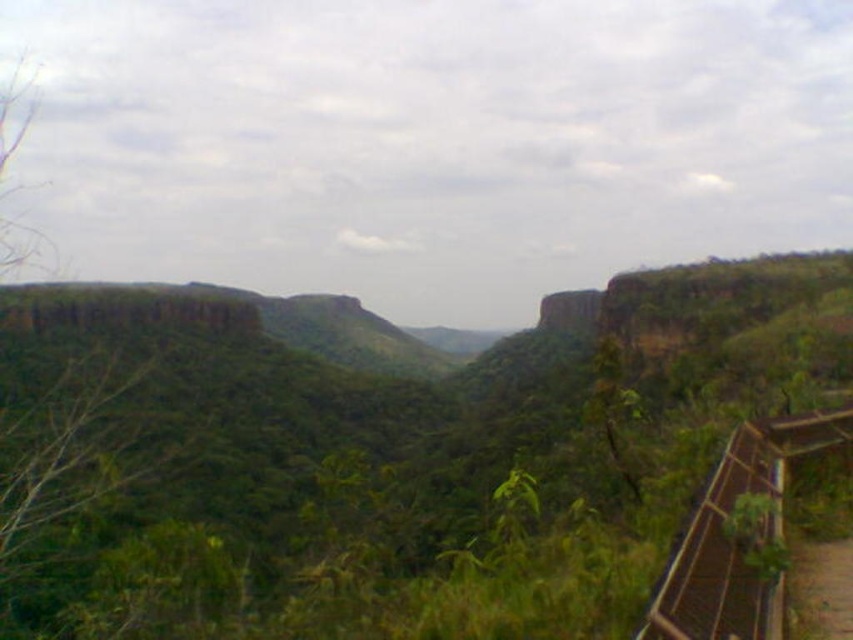
Who is shorter, green leafy vegetation at center or brown wooden path at lower right?

brown wooden path at lower right is shorter.

Is green leafy vegetation at center taller than brown wooden path at lower right?

Correct, green leafy vegetation at center is much taller as brown wooden path at lower right.

Does point (10, 310) come in front of point (827, 548)?

No, it is not.

Find the location of a particular element. green leafy vegetation at center is located at coordinates (392, 460).